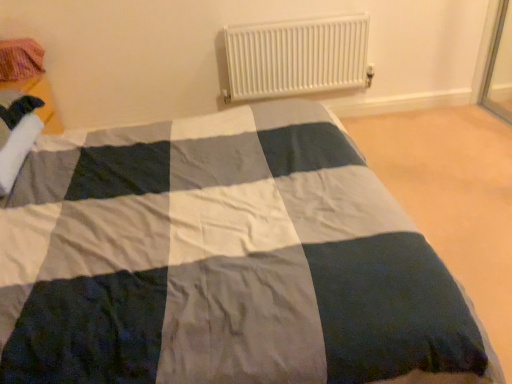
What is the approximate width of white plastic radiator at upper center?

3.77 inches.

This screenshot has width=512, height=384. What do you see at coordinates (297, 56) in the screenshot?
I see `white plastic radiator at upper center` at bounding box center [297, 56].

This screenshot has width=512, height=384. Identify the location of white plastic radiator at upper center. (297, 56).

Where is `pink knitted fabric at upper left`? The image size is (512, 384). pink knitted fabric at upper left is located at coordinates (20, 59).

The height and width of the screenshot is (384, 512). Describe the element at coordinates (20, 59) in the screenshot. I see `pink knitted fabric at upper left` at that location.

At what (x,y) coordinates should I click in order to perform the action: click on white plastic radiator at upper center. Please return your answer as a coordinate pair (x, y). Looking at the image, I should click on (297, 56).

Does pink knitted fabric at upper left appear on the right side of white plastic radiator at upper center?

Incorrect, pink knitted fabric at upper left is not on the right side of white plastic radiator at upper center.

Looking at this image, is the depth of pink knitted fabric at upper left less than that of white plastic radiator at upper center?

Yes, it is.

Which is closer, [18,66] or [274,96]?

The point [18,66] is closer.

From the image's perspective, is pink knitted fabric at upper left under white plastic radiator at upper center?

Yes, from the image's perspective, pink knitted fabric at upper left is beneath white plastic radiator at upper center.

From a real-world perspective, is pink knitted fabric at upper left below white plastic radiator at upper center?

Incorrect, from a real-world perspective, pink knitted fabric at upper left is higher than white plastic radiator at upper center.

Which object is wider, pink knitted fabric at upper left or white plastic radiator at upper center?

With larger width is pink knitted fabric at upper left.

Who is shorter, pink knitted fabric at upper left or white plastic radiator at upper center?

Standing shorter between the two is pink knitted fabric at upper left.

In terms of size, does pink knitted fabric at upper left appear bigger or smaller than white plastic radiator at upper center?

Considering their sizes, pink knitted fabric at upper left takes up less space than white plastic radiator at upper center.

Looking at this image, would you say pink knitted fabric at upper left contains white plastic radiator at upper center?

No, pink knitted fabric at upper left does not contain white plastic radiator at upper center.

Are pink knitted fabric at upper left and white plastic radiator at upper center beside each other?

No, pink knitted fabric at upper left is not next to white plastic radiator at upper center.

Is pink knitted fabric at upper left facing away from white plastic radiator at upper center?

No, pink knitted fabric at upper left's orientation is not away from white plastic radiator at upper center.

How different are the orientations of pink knitted fabric at upper left and white plastic radiator at upper center in degrees?

They differ by 90 degrees in their facing directions.

There is a white plastic radiator at upper center. What are the coordinates of `material above it (from a real-world perspective)` in the screenshot? It's located at (20, 59).

Is white plastic radiator at upper center to the left or to the right of pink knitted fabric at upper left in the image?

Clearly, white plastic radiator at upper center is on the right of pink knitted fabric at upper left in the image.

Does white plastic radiator at upper center come in front of pink knitted fabric at upper left?

That is False.

Which point is more distant from viewer, (341,61) or (14,77)?

Positioned behind is point (341,61).

From the image's perspective, is white plastic radiator at upper center on top of pink knitted fabric at upper left?

Yes.

From a real-world perspective, between white plastic radiator at upper center and pink knitted fabric at upper left, who is vertically lower?

In real-world perspective, white plastic radiator at upper center is lower.

Can you confirm if white plastic radiator at upper center is wider than pink knitted fabric at upper left?

No.

Considering the sizes of objects white plastic radiator at upper center and pink knitted fabric at upper left in the image provided, who is taller, white plastic radiator at upper center or pink knitted fabric at upper left?

white plastic radiator at upper center.

Considering the relative sizes of white plastic radiator at upper center and pink knitted fabric at upper left in the image provided, is white plastic radiator at upper center smaller than pink knitted fabric at upper left?

No.

Does white plastic radiator at upper center contain pink knitted fabric at upper left?

Actually, pink knitted fabric at upper left is outside white plastic radiator at upper center.

Is white plastic radiator at upper center with pink knitted fabric at upper left?

No, white plastic radiator at upper center is not touching pink knitted fabric at upper left.

Is white plastic radiator at upper center positioned with its back to pink knitted fabric at upper left?

No, white plastic radiator at upper center is not facing away from pink knitted fabric at upper left.

What's the angular difference between white plastic radiator at upper center and pink knitted fabric at upper left's facing directions?

The angular difference between white plastic radiator at upper center and pink knitted fabric at upper left is 90 degrees.

Where is `material above the white plastic radiator at upper center (from a real-world perspective)`? material above the white plastic radiator at upper center (from a real-world perspective) is located at coordinates (20, 59).

Where is `radiator that is above the pink knitted fabric at upper left (from the image's perspective)`? This screenshot has height=384, width=512. radiator that is above the pink knitted fabric at upper left (from the image's perspective) is located at coordinates (297, 56).

The width and height of the screenshot is (512, 384). I want to click on radiator on the right side of pink knitted fabric at upper left, so click(297, 56).